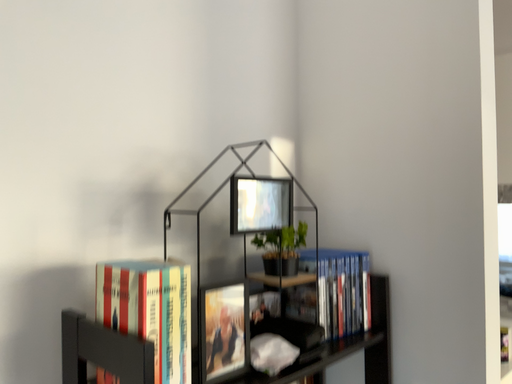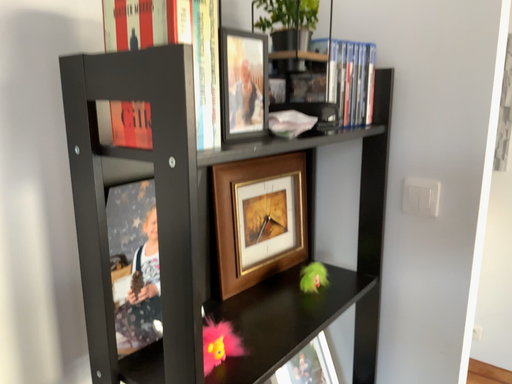
Question: Which way did the camera rotate in the video?

Choices:
 (A) rotated downward
 (B) rotated upward

Answer: (A)